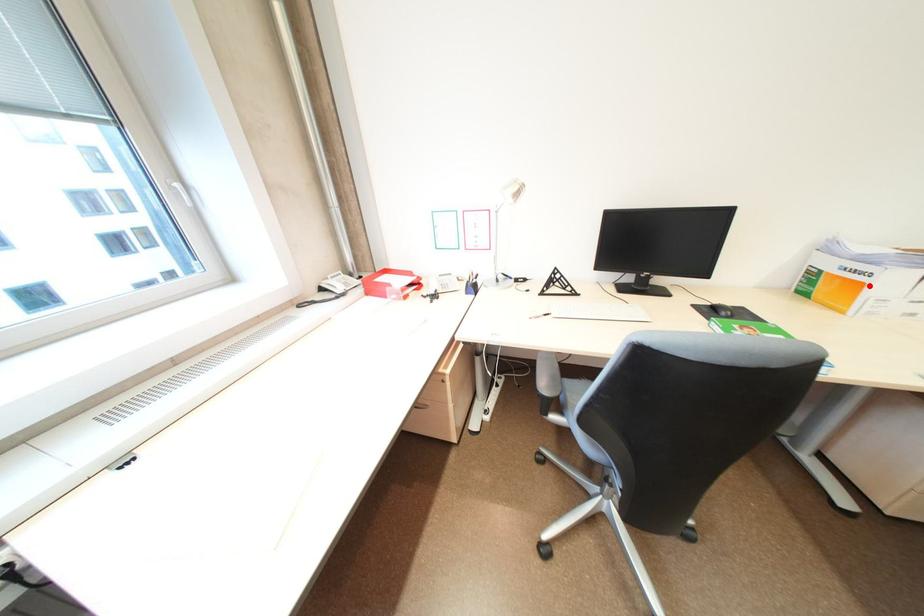
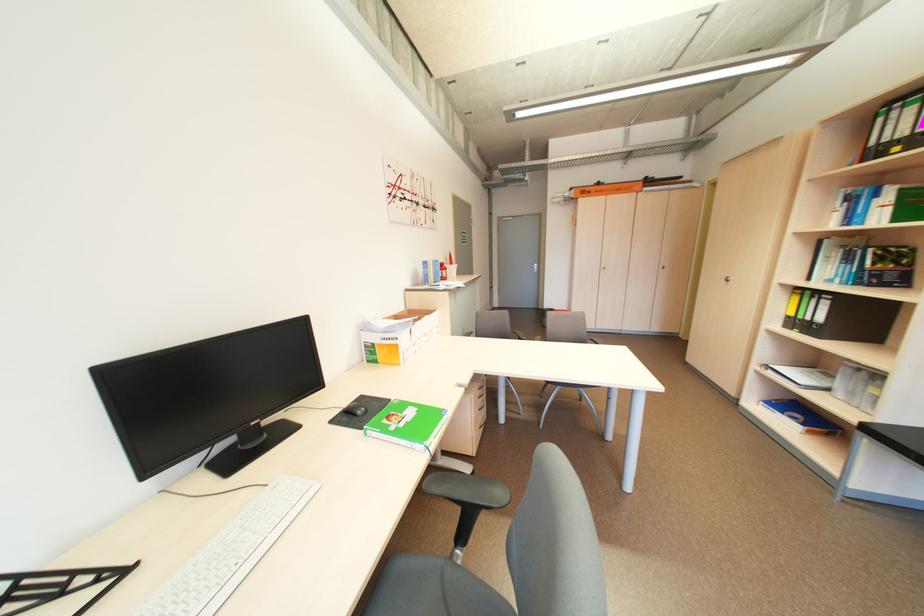
Where in the second image is the point corresponding to the highlighted location from the first image?

(406, 347)